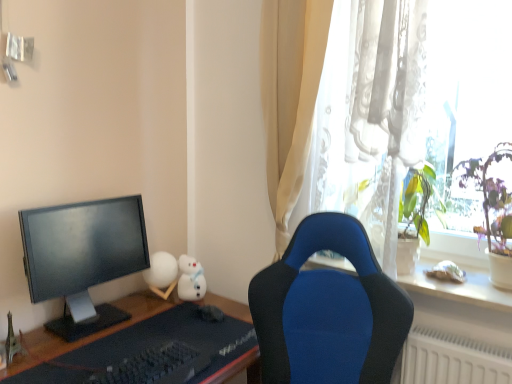
Image resolution: width=512 pixels, height=384 pixels. Identify the location of empty space that is in between white matte sphere at center-left, which is the first toy from back to front, and metallic silver eiffel tower at lower left, placed as the 4th toy when sorted from right to left. 89,322.